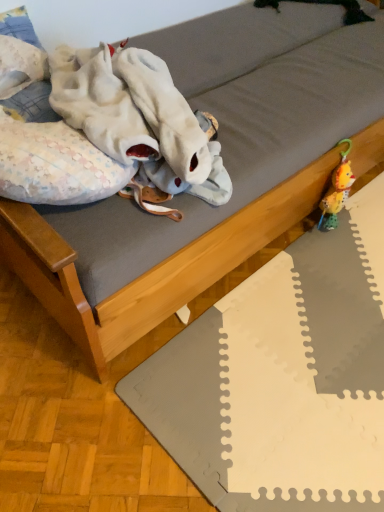
What do you see at coordinates (282, 377) in the screenshot?
I see `gray foam puzzle mat at lower right` at bounding box center [282, 377].

Find the location of `gray foam puzzle mat at lower right`. gray foam puzzle mat at lower right is located at coordinates (282, 377).

Locate an element on the screen. gray foam puzzle mat at lower right is located at coordinates pos(282,377).